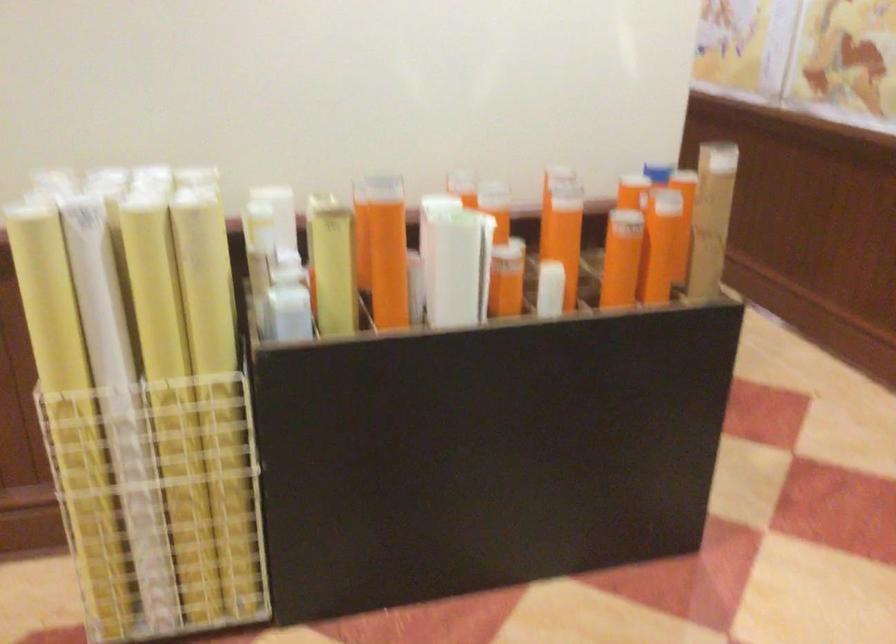
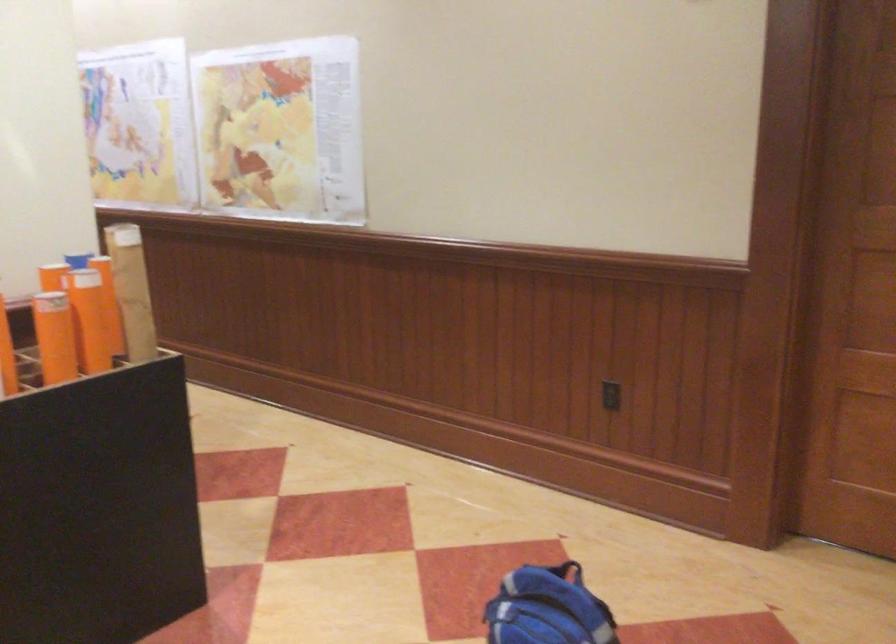
Where in the second image is the point corresponding to point (605, 261) from the first image?

(55, 337)